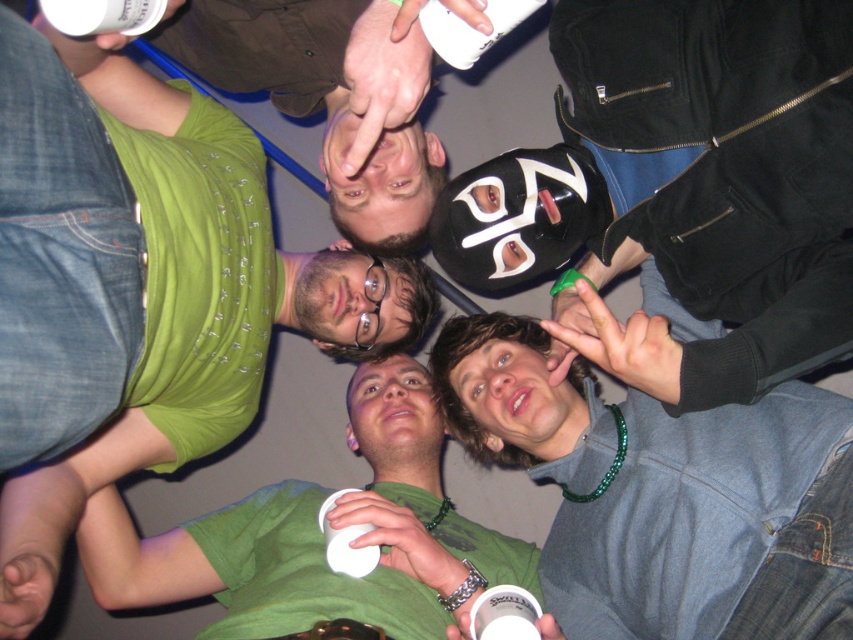
Question: Among these objects, which one is farthest from the camera?

Choices:
 (A) matte black mask at upper center
 (B) green matte shirt at center
 (C) gray-green hoodie at center

Answer: (B)

Question: Estimate the real-world distances between objects in this image. Which object is farther from the gray-green hoodie at center?

Choices:
 (A) matte black mask at upper center
 (B) green matte shirt at center

Answer: (B)

Question: Considering the relative positions of matte black mask at upper center and gray-green hoodie at center in the image provided, where is matte black mask at upper center located with respect to gray-green hoodie at center?

Choices:
 (A) right
 (B) left

Answer: (B)

Question: Among these points, which one is nearest to the camera?

Choices:
 (A) tap(332, 579)
 (B) tap(723, 148)

Answer: (B)

Question: Observing the image, what is the correct spatial positioning of matte black mask at upper center in reference to gray-green hoodie at center?

Choices:
 (A) below
 (B) above

Answer: (B)

Question: Observing the image, what is the correct spatial positioning of gray-green hoodie at center in reference to green matte shirt at center?

Choices:
 (A) left
 (B) right

Answer: (B)